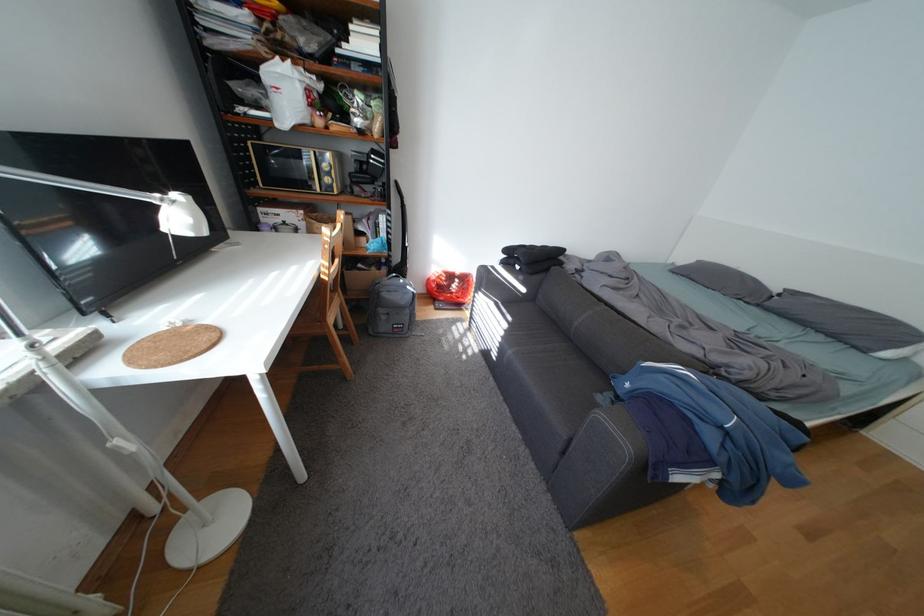
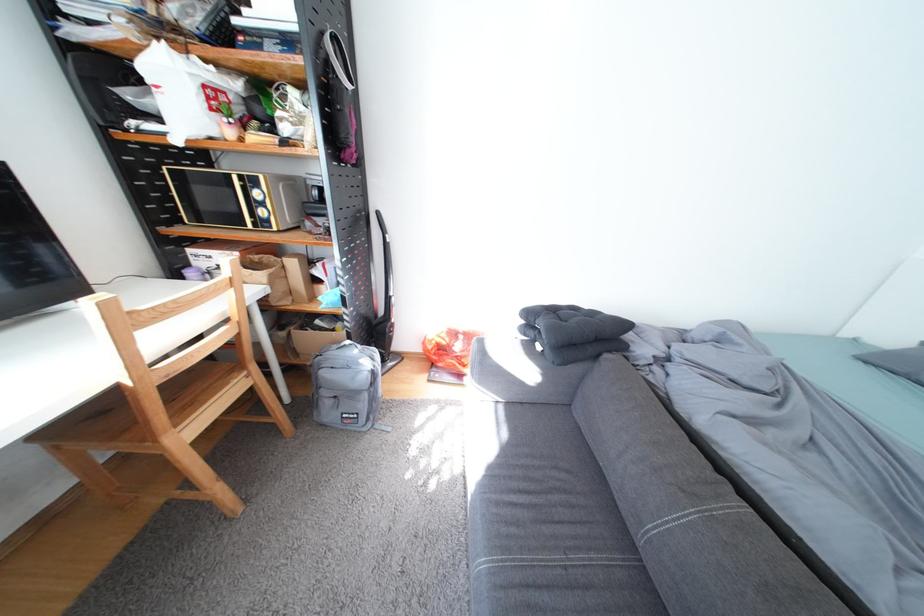
Find the pixel in the second image that matches point 530,268 in the first image.

(552, 347)